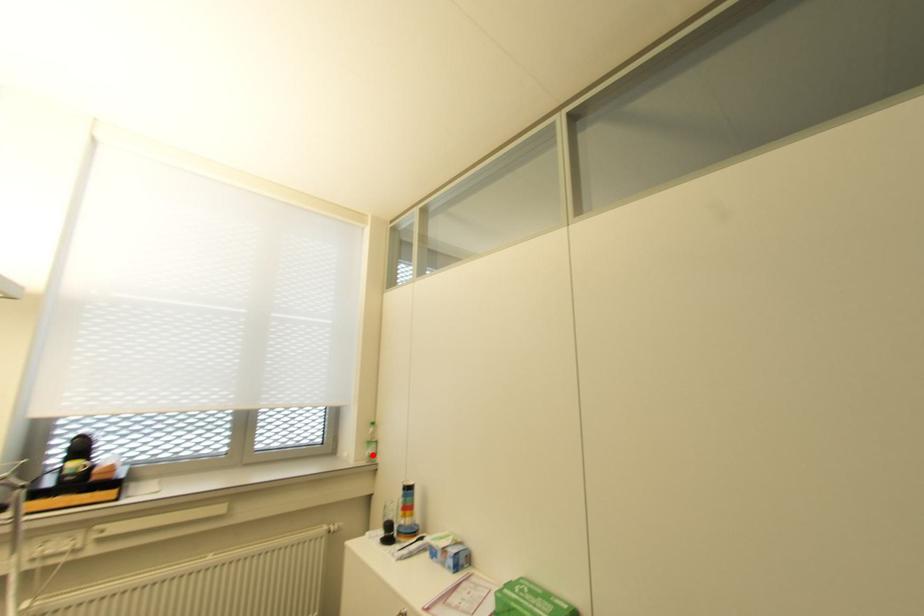
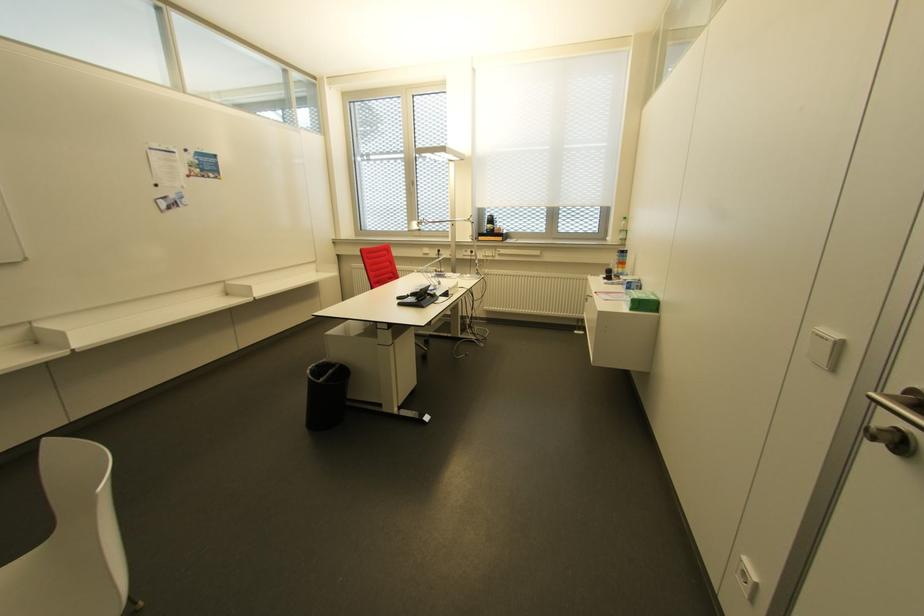
The point at the highlighted location is marked in the first image. Where is the corresponding point in the second image?

(623, 240)